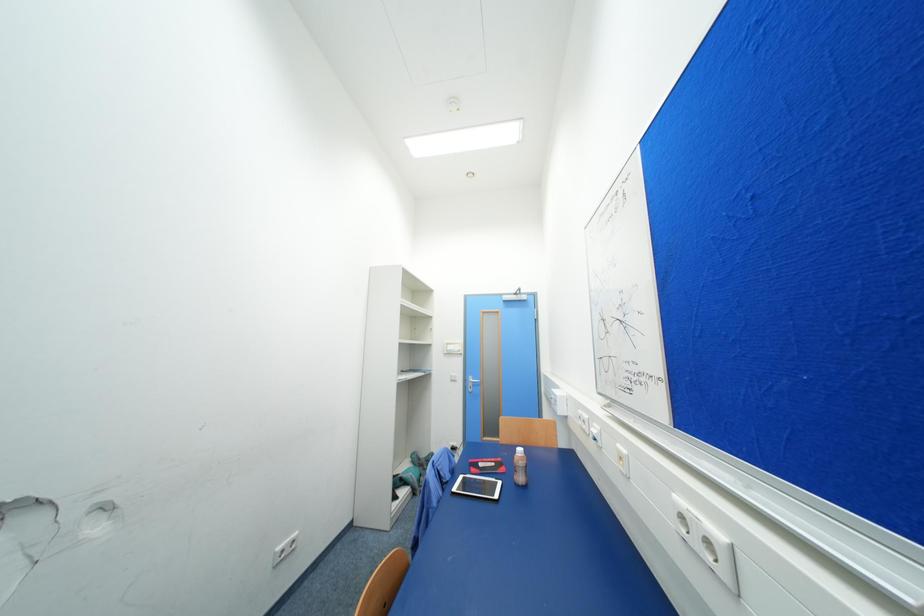
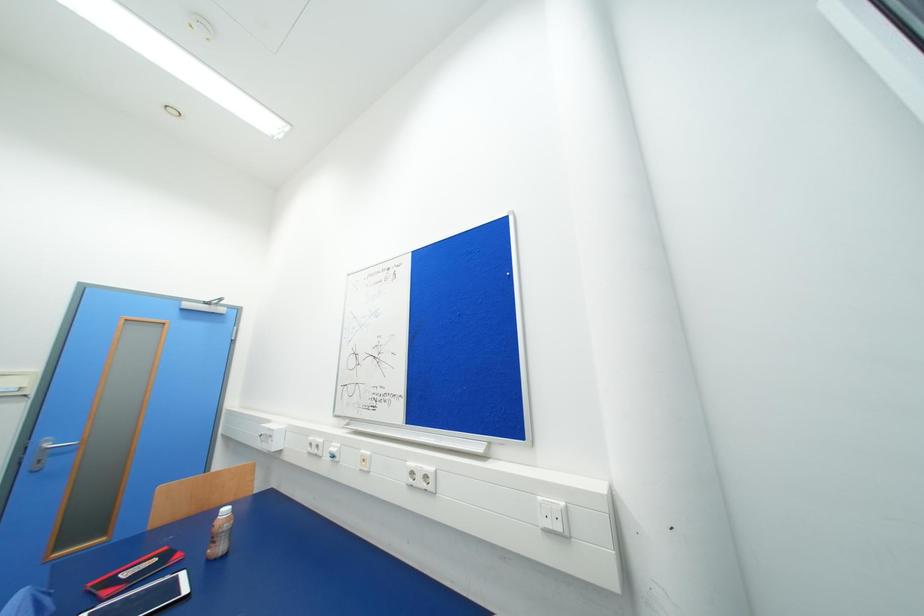
Question: How did the camera likely rotate?

Choices:
 (A) Left
 (B) Right
 (C) Up
 (D) Down

Answer: (B)